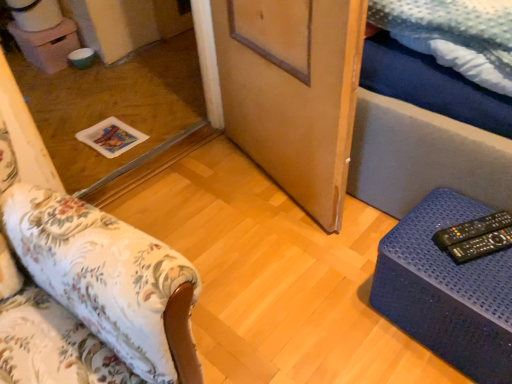
This screenshot has height=384, width=512. I want to click on blank space situated above blue textured ottoman at lower right, which is counted as the second furniture, starting from the left (from a real-world perspective), so click(x=461, y=244).